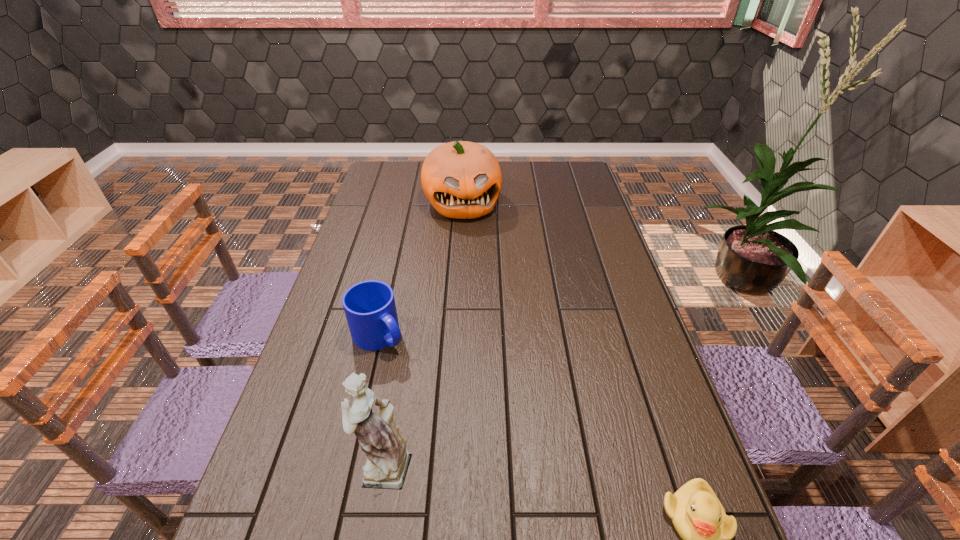
Identify the location of object that is the nearest to the figurine. (369, 306).

Find the location of a particular element. The image size is (960, 540). blank area in the image that satisfies the following two spatial constraints: 1. on the front side of the second farthest object; 2. on the front-facing side of the tallest object is located at coordinates (350, 464).